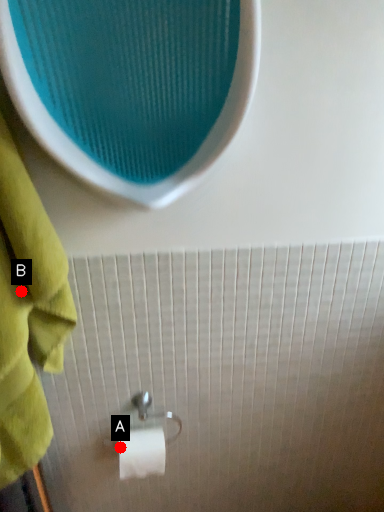
Question: Two points are circled on the image, labeled by A and B beside each circle. Among these points, which one is farthest from the camera?

Choices:
 (A) A is further
 (B) B is further

Answer: (A)